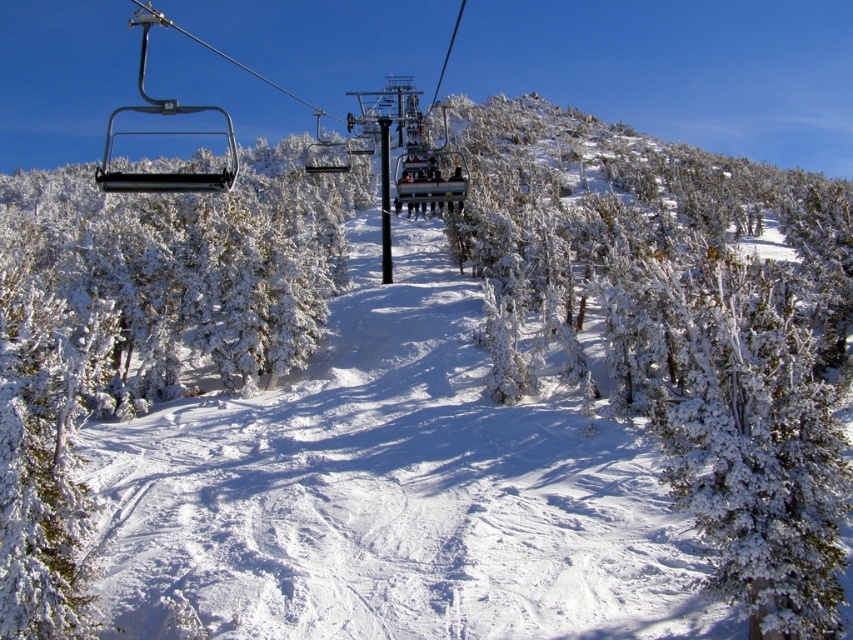
You are standing at a point in the snowy mountain landscape and see two points marked in the image. The first point is at coordinates point (801, 518) and the second is at point (9, 381). Which of these two points is closer to you?

Point (801, 518) is in front of point (9, 381), so it is closer to you.